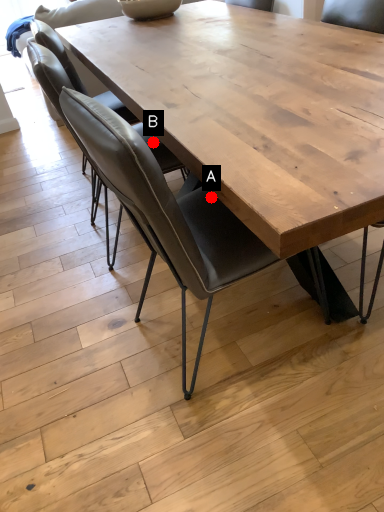
Question: Two points are circled on the image, labeled by A and B beside each circle. Which point is further to the camera?

Choices:
 (A) A is further
 (B) B is further

Answer: (B)